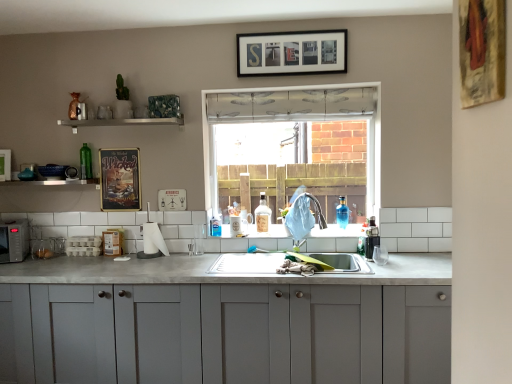
Question: Is transparent plastic window at center wider than green glass bottle at upper left, acting as the third bottle starting from the right?

Choices:
 (A) yes
 (B) no

Answer: (A)

Question: Does transparent plastic window at center have a smaller size compared to green glass bottle at upper left, which is counted as the first bottle, starting from the left?

Choices:
 (A) yes
 (B) no

Answer: (B)

Question: From the image's perspective, is transparent plastic window at center beneath green glass bottle at upper left, acting as the third bottle starting from the right?

Choices:
 (A) no
 (B) yes

Answer: (B)

Question: Can you confirm if transparent plastic window at center is shorter than green glass bottle at upper left, which is counted as the first bottle, starting from the left?

Choices:
 (A) no
 (B) yes

Answer: (A)

Question: Considering the relative positions of transparent plastic window at center and green glass bottle at upper left, which is counted as the first bottle, starting from the left, in the image provided, is transparent plastic window at center to the left of green glass bottle at upper left, which is counted as the first bottle, starting from the left, from the viewer's perspective?

Choices:
 (A) yes
 (B) no

Answer: (B)

Question: Is transparent plastic window at center outside green glass bottle at upper left, which is counted as the first bottle, starting from the left?

Choices:
 (A) yes
 (B) no

Answer: (A)

Question: Is matte gray cabinets at center completely or partially outside of white glossy shelf at upper center, which ranks as the first window sill in top-to-bottom order?

Choices:
 (A) no
 (B) yes

Answer: (B)

Question: Would you consider matte gray cabinets at center to be distant from white glossy shelf at upper center, which is the first window sill in right-to-left order?

Choices:
 (A) yes
 (B) no

Answer: (A)

Question: Considering the relative sizes of matte gray cabinets at center and white glossy shelf at upper center, positioned as the 2th window sill in left-to-right order, in the image provided, is matte gray cabinets at center bigger than white glossy shelf at upper center, positioned as the 2th window sill in left-to-right order,?

Choices:
 (A) no
 (B) yes

Answer: (B)

Question: Is matte gray cabinets at center at the right side of white glossy shelf at upper center, which is counted as the 2th window sill, starting from the bottom?

Choices:
 (A) no
 (B) yes

Answer: (B)

Question: Is matte gray cabinets at center thinner than white glossy shelf at upper center, positioned as the 2th window sill in left-to-right order?

Choices:
 (A) no
 (B) yes

Answer: (A)

Question: Could white glossy shelf at upper center, which ranks as the first window sill in top-to-bottom order, be considered to be inside matte gray cabinets at center?

Choices:
 (A) yes
 (B) no

Answer: (B)

Question: Does blue glass bottle at sink, which appears as the third bottle when viewed from the left, have a smaller size compared to white glossy shelf at upper center, which is the first window sill in right-to-left order?

Choices:
 (A) no
 (B) yes

Answer: (B)